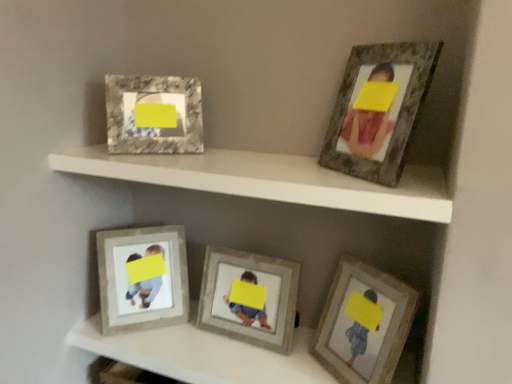
Question: From the image's perspective, is rustic wood frame at upper right, the 1th picture frame viewed from the right, above marble-like frame at upper left, positioned as the 2th picture frame in left-to-right order?

Choices:
 (A) yes
 (B) no

Answer: (B)

Question: Is rustic wood frame at upper right, the 5th picture frame when ordered from left to right, to the right of marble-like frame at upper left, positioned as the 2th picture frame in left-to-right order, from the viewer's perspective?

Choices:
 (A) yes
 (B) no

Answer: (A)

Question: Can you confirm if rustic wood frame at upper right, the 1th picture frame viewed from the right, is taller than marble-like frame at upper left, arranged as the fourth picture frame when viewed from the right?

Choices:
 (A) yes
 (B) no

Answer: (A)

Question: Does rustic wood frame at upper right, the 1th picture frame viewed from the right, have a smaller size compared to marble-like frame at upper left, positioned as the 2th picture frame in left-to-right order?

Choices:
 (A) no
 (B) yes

Answer: (A)

Question: Is rustic wood frame at upper right, the 1th picture frame viewed from the right, aimed at marble-like frame at upper left, positioned as the 2th picture frame in left-to-right order?

Choices:
 (A) yes
 (B) no

Answer: (B)

Question: Do you think wooden photo frame at lower right, which is the fourth picture frame from left to right, is within marble-like frame at upper left, arranged as the fourth picture frame when viewed from the right, or outside of it?

Choices:
 (A) inside
 (B) outside

Answer: (B)

Question: Considering the positions of wooden photo frame at lower right, which appears as the 2th picture frame when viewed from the right, and marble-like frame at upper left, positioned as the 2th picture frame in left-to-right order, in the image, is wooden photo frame at lower right, which appears as the 2th picture frame when viewed from the right, wider or thinner than marble-like frame at upper left, positioned as the 2th picture frame in left-to-right order,?

Choices:
 (A) wide
 (B) thin

Answer: (A)

Question: Visually, is wooden photo frame at lower right, which appears as the 2th picture frame when viewed from the right, positioned to the left or to the right of marble-like frame at upper left, positioned as the 2th picture frame in left-to-right order?

Choices:
 (A) right
 (B) left

Answer: (A)

Question: Considering the positions of wooden photo frame at lower right, which is the fourth picture frame from left to right, and marble-like frame at upper left, arranged as the fourth picture frame when viewed from the right, in the image, is wooden photo frame at lower right, which is the fourth picture frame from left to right, taller or shorter than marble-like frame at upper left, arranged as the fourth picture frame when viewed from the right,?

Choices:
 (A) short
 (B) tall

Answer: (B)

Question: In terms of height, does rustic wood frame at upper right, the 5th picture frame when ordered from left to right, look taller or shorter compared to marble-like frame at upper left, arranged as the fourth picture frame when viewed from the right?

Choices:
 (A) tall
 (B) short

Answer: (A)

Question: Does point (394, 165) appear closer or farther from the camera than point (157, 77)?

Choices:
 (A) closer
 (B) farther

Answer: (A)

Question: In terms of width, does rustic wood frame at upper right, the 5th picture frame when ordered from left to right, look wider or thinner when compared to marble-like frame at upper left, arranged as the fourth picture frame when viewed from the right?

Choices:
 (A) thin
 (B) wide

Answer: (B)

Question: Based on their positions, is rustic wood frame at upper right, the 1th picture frame viewed from the right, located to the left or right of marble-like frame at upper left, positioned as the 2th picture frame in left-to-right order?

Choices:
 (A) left
 (B) right

Answer: (B)

Question: Is marble-like frame at upper left, arranged as the fourth picture frame when viewed from the right, inside or outside of rustic wood frame at upper right, the 5th picture frame when ordered from left to right?

Choices:
 (A) inside
 (B) outside

Answer: (B)

Question: In terms of height, does marble-like frame at upper left, positioned as the 2th picture frame in left-to-right order, look taller or shorter compared to rustic wood frame at upper right, the 5th picture frame when ordered from left to right?

Choices:
 (A) tall
 (B) short

Answer: (B)